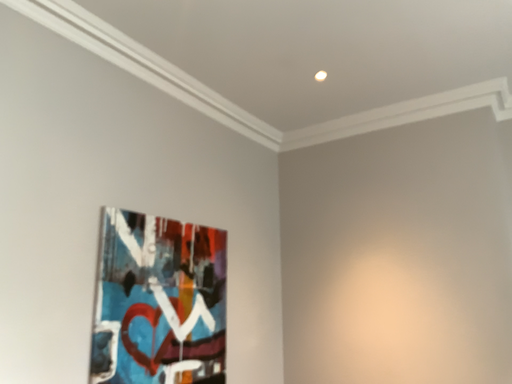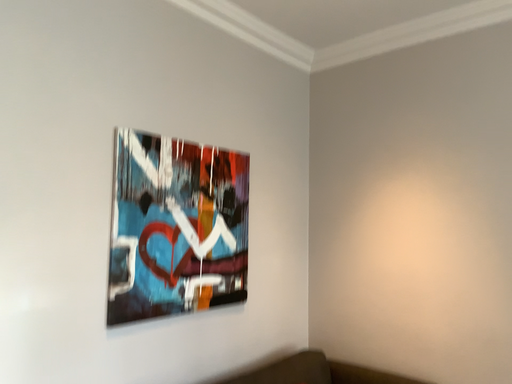
Question: How did the camera likely rotate when shooting the video?

Choices:
 (A) rotated left
 (B) rotated right

Answer: (A)